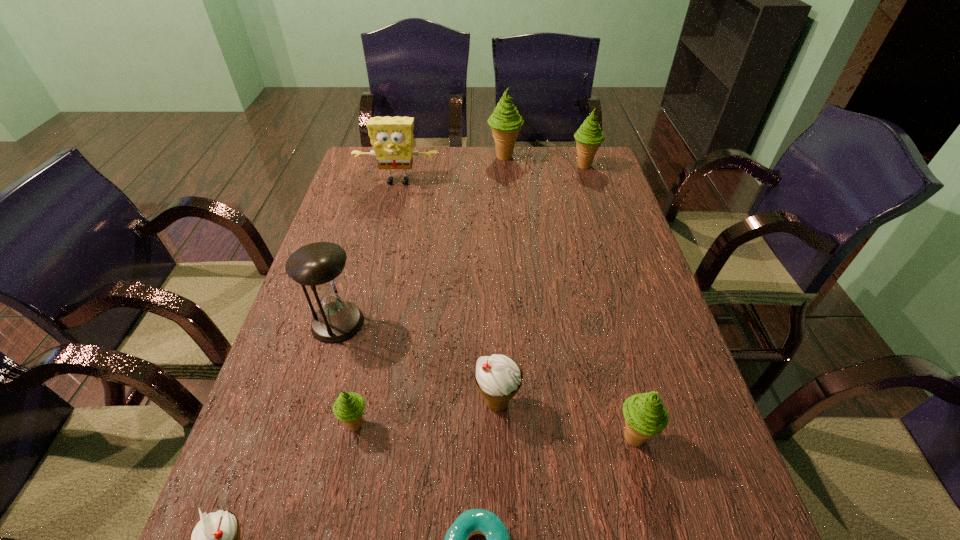
This screenshot has height=540, width=960. I want to click on free spot that satisfies the following two spatial constraints: 1. on the face of the sponge; 2. on the right side of the fifth icecream from right to left, so click(341, 424).

At what (x,y) coordinates should I click in order to perform the action: click on blank space that satisfies the following two spatial constraints: 1. on the back side of the right white icecream; 2. on the right side of the leftmost green icecream. Please return your answer as a coordinate pair (x, y). This screenshot has width=960, height=540. Looking at the image, I should click on (361, 403).

You are a GUI agent. You are given a task and a screenshot of the screen. Output one action in this format:
    pyautogui.click(x=<x>, y=<y>)
    Task: Click on the free location that satisfies the following two spatial constraints: 1. on the front side of the third biggest green icecream; 2. on the left side of the second green icecream from left to right
    
    Given the screenshot: What is the action you would take?
    pyautogui.click(x=525, y=437)